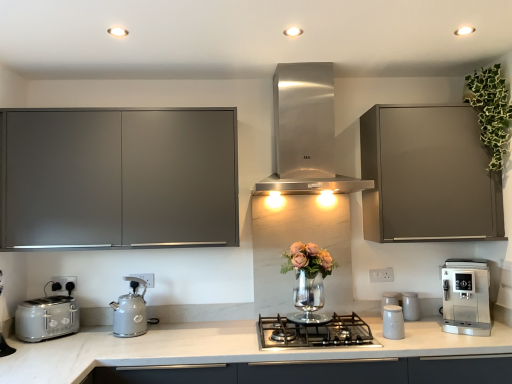
Measure the distance between point [33,126] and camera.

The depth of point [33,126] is 2.26 meters.

At what (x,y) coordinates should I click in order to perform the action: click on matte gray cabinet at left, acting as the second cabinetry starting from the right. Please return your answer as a coordinate pair (x, y). Looking at the image, I should click on (118, 178).

What do you see at coordinates (46, 318) in the screenshot? I see `satin silver toaster at left` at bounding box center [46, 318].

In order to face white matte jar at center-right, marked as the 3th kitchen appliance in a right-to-left arrangement, should I rotate leftwards or rightwards?

A 17.552 degree turn to the right will do.

The width and height of the screenshot is (512, 384). Find the location of `white plastic electric outlet at lower right, the first electric outlet in the right-to-left sequence`. white plastic electric outlet at lower right, the first electric outlet in the right-to-left sequence is located at coordinates (506, 274).

Is point (400, 314) in front of point (476, 109)?

That is True.

In the image, is white matte jar at center-right, marked as the 3th kitchen appliance in a right-to-left arrangement, positioned in front of or behind green leafy plant at upper right?

In the image, white matte jar at center-right, marked as the 3th kitchen appliance in a right-to-left arrangement, appears in front of green leafy plant at upper right.

From a real-world perspective, is white matte jar at center-right, acting as the fourth kitchen appliance starting from the back, over green leafy plant at upper right?

No, from a real-world perspective, white matte jar at center-right, acting as the fourth kitchen appliance starting from the back, is not on top of green leafy plant at upper right.

Which object is thinner, stainless steel range hood at center, which is counted as the 2th home appliance, starting from the bottom, or matte grey kettle at lower left, which is the 3th kitchen appliance in back-to-front order?

matte grey kettle at lower left, which is the 3th kitchen appliance in back-to-front order.

Is stainless steel range hood at center, arranged as the first home appliance when viewed from the top, turned away from matte grey kettle at lower left, which is the 3th kitchen appliance in back-to-front order?

No, stainless steel range hood at center, arranged as the first home appliance when viewed from the top, is not facing the opposite direction of matte grey kettle at lower left, which is the 3th kitchen appliance in back-to-front order.

From a real-world perspective, who is located higher, stainless steel range hood at center, which is counted as the 2th home appliance, starting from the bottom, or matte grey kettle at lower left, the 4th kitchen appliance viewed from the right?

stainless steel range hood at center, which is counted as the 2th home appliance, starting from the bottom, is physically above.

Can you tell me how much stainless steel range hood at center, which is counted as the 2th home appliance, starting from the bottom, and matte grey kettle at lower left, marked as the first kitchen appliance in a left-to-right arrangement, differ in facing direction?

stainless steel range hood at center, which is counted as the 2th home appliance, starting from the bottom, and matte grey kettle at lower left, marked as the first kitchen appliance in a left-to-right arrangement, are facing 0.481 degrees away from each other.

Is white glossy canisters at center-right, which is the 3th kitchen appliance in left-to-right order, completely or partially outside of white matte jar at center-right, arranged as the first kitchen appliance when viewed from the front?

Yes, white glossy canisters at center-right, which is the 3th kitchen appliance in left-to-right order, is located beyond the bounds of white matte jar at center-right, arranged as the first kitchen appliance when viewed from the front.

Which is closer to the camera, (396, 300) or (397, 312)?

Positioned in front is point (397, 312).

Is white glossy canisters at center-right, arranged as the second kitchen appliance when viewed from the right, in front of or behind white matte jar at center-right, arranged as the second kitchen appliance when viewed from the left, in the image?

Clearly, white glossy canisters at center-right, arranged as the second kitchen appliance when viewed from the right, is behind white matte jar at center-right, arranged as the second kitchen appliance when viewed from the left.

Which of these two, white glossy canisters at center-right, which is the 3th kitchen appliance in left-to-right order, or white matte jar at center-right, marked as the 3th kitchen appliance in a right-to-left arrangement, is wider?

Wider between the two is white matte jar at center-right, marked as the 3th kitchen appliance in a right-to-left arrangement.

Is white plastic electric outlet at center, marked as the first electric outlet in a back-to-front arrangement, directly adjacent to matte gray cabinet at left, acting as the second cabinetry starting from the right?

white plastic electric outlet at center, marked as the first electric outlet in a back-to-front arrangement, is not next to matte gray cabinet at left, acting as the second cabinetry starting from the right, and they're not touching.

Between white plastic electric outlet at center, marked as the first electric outlet in a back-to-front arrangement, and matte gray cabinet at left, arranged as the 1th cabinetry when viewed from the left, which one has smaller width?

white plastic electric outlet at center, marked as the first electric outlet in a back-to-front arrangement.

Consider the image. Which point is more distant from viewer, (375, 269) or (121, 232)?

The point (375, 269) is more distant.

Is matte gray cabinet at left, arranged as the 1th cabinetry when viewed from the left, at the back of white plastic electric outlet at center, the second electric outlet when ordered from right to left?

No, white plastic electric outlet at center, the second electric outlet when ordered from right to left, is not facing the opposite direction of matte gray cabinet at left, arranged as the 1th cabinetry when viewed from the left.

From the image's perspective, is white plastic electric outlet at lower center, which is the second electric outlet from front to back, above or below green leafy plant at upper right?

white plastic electric outlet at lower center, which is the second electric outlet from front to back, is situated lower than green leafy plant at upper right in the image.

Is white plastic electric outlet at lower center, which is the 1th electric outlet in left-to-right order, not close to green leafy plant at upper right?

Yes.

Which of these two, white plastic electric outlet at lower center, positioned as the third electric outlet in right-to-left order, or green leafy plant at upper right, is wider?

green leafy plant at upper right is wider.

From a real-world perspective, is white plastic electric outlet at lower center, which is the 1th electric outlet in left-to-right order, on top of green leafy plant at upper right?

No, from a real-world perspective, white plastic electric outlet at lower center, which is the 1th electric outlet in left-to-right order, is not above green leafy plant at upper right.

Can you confirm if white marble countertop at center is taller than white plastic electric outlet at center, marked as the first electric outlet in a back-to-front arrangement?

Correct, white marble countertop at center is much taller as white plastic electric outlet at center, marked as the first electric outlet in a back-to-front arrangement.

Considering the relative positions of white marble countertop at center and white plastic electric outlet at center, the second electric outlet when ordered from right to left, in the image provided, is white marble countertop at center to the left or to the right of white plastic electric outlet at center, the second electric outlet when ordered from right to left,?

Based on their positions, white marble countertop at center is located to the left of white plastic electric outlet at center, the second electric outlet when ordered from right to left.

From a real-world perspective, which object stands above the other?

white plastic electric outlet at center, marked as the first electric outlet in a back-to-front arrangement, from a real-world perspective.

Does point (150, 358) come behind point (383, 274)?

No, (150, 358) is closer to viewer.

From a real-world perspective, is white ceramic canisters at center-right, marked as the first kitchen appliance in a right-to-left arrangement, positioned above or below white glossy canisters at center-right, arranged as the second kitchen appliance when viewed from the right?

Clearly, from a real-world perspective, white ceramic canisters at center-right, marked as the first kitchen appliance in a right-to-left arrangement, is above white glossy canisters at center-right, arranged as the second kitchen appliance when viewed from the right.

Can we say white ceramic canisters at center-right, positioned as the 4th kitchen appliance in left-to-right order, lies outside white glossy canisters at center-right, the 2th kitchen appliance positioned from the back?

white ceramic canisters at center-right, positioned as the 4th kitchen appliance in left-to-right order, is positioned outside white glossy canisters at center-right, the 2th kitchen appliance positioned from the back.

Is white ceramic canisters at center-right, marked as the first kitchen appliance in a right-to-left arrangement, oriented towards white glossy canisters at center-right, arranged as the second kitchen appliance when viewed from the right?

No.

In terms of size, does white ceramic canisters at center-right, marked as the first kitchen appliance in a right-to-left arrangement, appear bigger or smaller than white glossy canisters at center-right, the 2th kitchen appliance positioned from the back?

In the image, white ceramic canisters at center-right, marked as the first kitchen appliance in a right-to-left arrangement, appears to be smaller than white glossy canisters at center-right, the 2th kitchen appliance positioned from the back.

Where is `floral arrangement that appears above the white matte jar at center-right, arranged as the second kitchen appliance when viewed from the left (from the image's perspective)`? floral arrangement that appears above the white matte jar at center-right, arranged as the second kitchen appliance when viewed from the left (from the image's perspective) is located at coordinates (490, 111).

Locate an element on the screen. This screenshot has height=384, width=512. kitchen appliance to the left of stainless steel range hood at center, arranged as the first home appliance when viewed from the top is located at coordinates (130, 311).

Which object lies further to the anchor point satin silver toaster at left, matte gray cabinet at upper right, which ranks as the second cabinetry in left-to-right order, or white plastic electric outlet at lower center, which is the second electric outlet from front to back?

Among the two, matte gray cabinet at upper right, which ranks as the second cabinetry in left-to-right order, is located further to satin silver toaster at left.

Considering their positions, is matte gray cabinet at left, acting as the second cabinetry starting from the right, positioned closer to white plastic electric outlet at lower center, which is the 1th electric outlet in left-to-right order, than white marble countertop at center?

matte gray cabinet at left, acting as the second cabinetry starting from the right, lies closer to white plastic electric outlet at lower center, which is the 1th electric outlet in left-to-right order, than the other object.

When comparing their distances from satin silver coffee machine at lower right, positioned as the 2th home appliance in left-to-right order, does green leafy plant at upper right or white plastic electric outlet at center, acting as the second electric outlet starting from the left, seem closer?

white plastic electric outlet at center, acting as the second electric outlet starting from the left, is positioned closer to the anchor satin silver coffee machine at lower right, positioned as the 2th home appliance in left-to-right order.

Which object lies further to the anchor point white ceramic canisters at center-right, the fourth kitchen appliance positioned from the front, white plastic electric outlet at lower center, the second electric outlet viewed from the back, or white plastic electric outlet at lower right, placed as the first electric outlet when sorted from front to back?

Based on the image, white plastic electric outlet at lower center, the second electric outlet viewed from the back, appears to be further to white ceramic canisters at center-right, the fourth kitchen appliance positioned from the front.

When comparing their distances from white glossy canisters at center-right, the 2th kitchen appliance positioned from the back, does matte grey kettle at lower left, acting as the 2th kitchen appliance starting from the front, or green leafy plant at upper right seem further?

Among the two, matte grey kettle at lower left, acting as the 2th kitchen appliance starting from the front, is located further to white glossy canisters at center-right, the 2th kitchen appliance positioned from the back.

When comparing their distances from white plastic electric outlet at lower center, the second electric outlet viewed from the back, does matte gray cabinet at left, arranged as the 1th cabinetry when viewed from the left, or white glossy canisters at center-right, arranged as the second kitchen appliance when viewed from the right, seem further?

white glossy canisters at center-right, arranged as the second kitchen appliance when viewed from the right.

Based on their spatial positions, is white ceramic canisters at center-right, marked as the first kitchen appliance in a right-to-left arrangement, or white matte jar at center-right, marked as the 3th kitchen appliance in a right-to-left arrangement, further from matte gray cabinet at upper right, acting as the 1th cabinetry starting from the right?

white ceramic canisters at center-right, marked as the first kitchen appliance in a right-to-left arrangement, is further to matte gray cabinet at upper right, acting as the 1th cabinetry starting from the right.

Based on their spatial positions, is matte gray cabinet at upper right, acting as the 1th cabinetry starting from the right, or matte grey kettle at lower left, the 4th kitchen appliance viewed from the right, closer to white marble countertop at center?

matte grey kettle at lower left, the 4th kitchen appliance viewed from the right, lies closer to white marble countertop at center than the other object.

Where is `home appliance between stainless steel range hood at center, which appears as the second home appliance when viewed from the right, and stainless steel gas stove at center vertically`? home appliance between stainless steel range hood at center, which appears as the second home appliance when viewed from the right, and stainless steel gas stove at center vertically is located at coordinates click(x=466, y=297).

This screenshot has height=384, width=512. Identify the location of countertop between matte gray cabinet at left, acting as the second cabinetry starting from the right, and white plastic electric outlet at center, positioned as the third electric outlet in front-to-back order, from left to right. (218, 348).

Where is `cabinetry between stainless steel range hood at center, which is counted as the 2th home appliance, starting from the bottom, and green leafy plant at upper right, in the horizontal direction`? cabinetry between stainless steel range hood at center, which is counted as the 2th home appliance, starting from the bottom, and green leafy plant at upper right, in the horizontal direction is located at coordinates (428, 176).

Where is `gas stove between satin silver toaster at left and white plastic electric outlet at lower right, the first electric outlet in the right-to-left sequence, in the horizontal direction`? This screenshot has height=384, width=512. gas stove between satin silver toaster at left and white plastic electric outlet at lower right, the first electric outlet in the right-to-left sequence, in the horizontal direction is located at coordinates (314, 332).